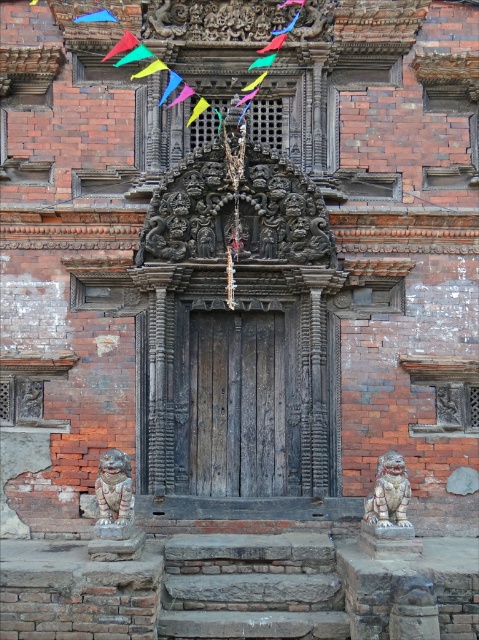
Question: Does weathered wood door at center come in front of white stone lion at lower right?

Choices:
 (A) no
 (B) yes

Answer: (A)

Question: Where is weathered wood door at center located in relation to polished silver lion at lower left in the image?

Choices:
 (A) left
 (B) right

Answer: (B)

Question: Which point is closer to the camera?

Choices:
 (A) white stone lion at lower right
 (B) weathered wood door at center

Answer: (A)

Question: Which point appears farthest from the camera in this image?

Choices:
 (A) (128, 536)
 (B) (82, 17)
 (C) (365, 506)
 (D) (204, 486)

Answer: (B)

Question: Which point is closer to the camera?

Choices:
 (A) polished silver lion at lower left
 (B) white stone lion at lower right
 (C) weathered wood door at center
 (D) blue fabric flag at upper left

Answer: (A)

Question: Does weathered wood door at center have a lesser width compared to polished silver lion at lower left?

Choices:
 (A) yes
 (B) no

Answer: (B)